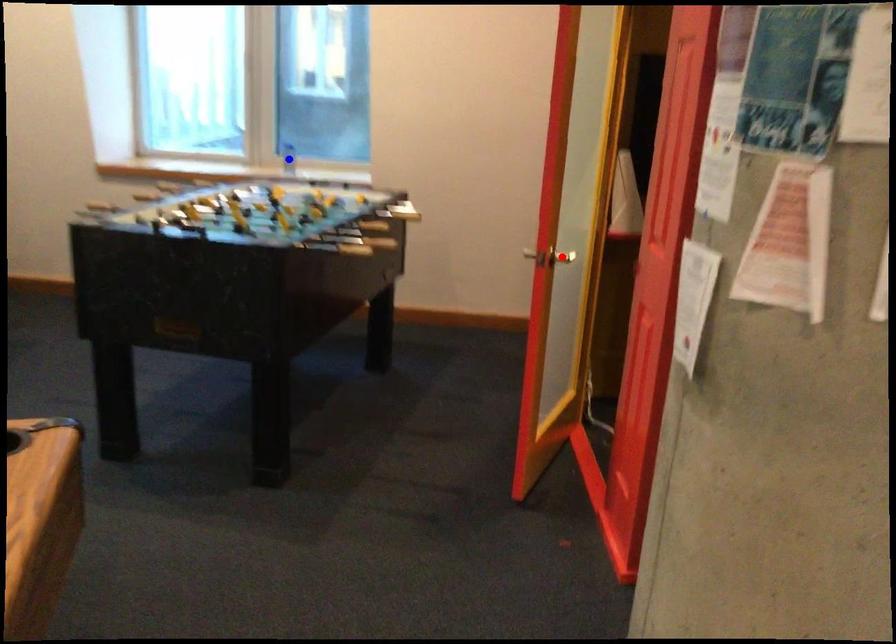
Question: Two points are marked on the image. Which point is closer to the camera?

Choices:
 (A) Blue point is closer.
 (B) Red point is closer.

Answer: (B)